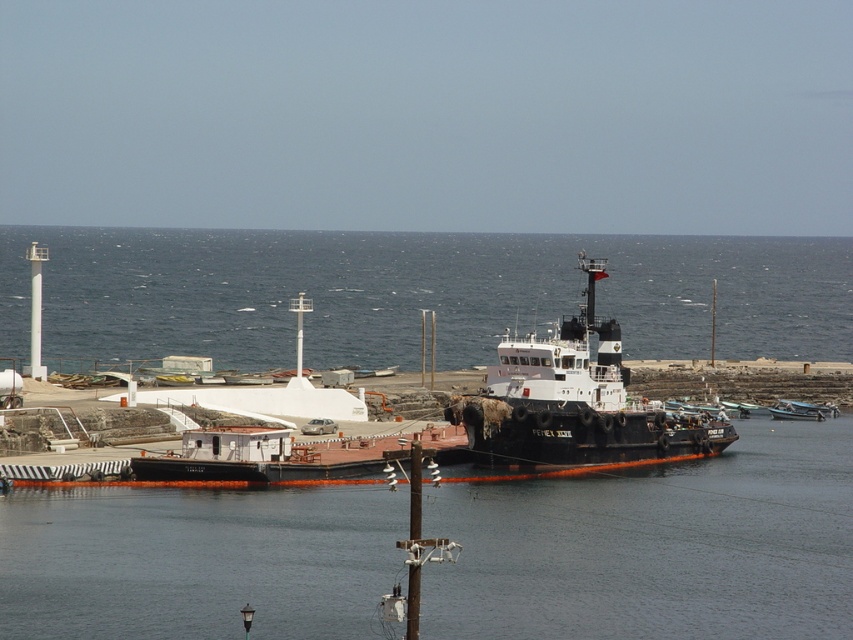
You are a harbor pilot who needs to guide a cargo ship through the channel. The cargo ship requires a minimum clearance of 400 feet between the blue water at center and the black rubber boat at center to safely pass. Based on the scene, is the current distance sufficient?

The blue water at center and black rubber boat at center are 411.43 feet apart. Since this distance exceeds the required 400 feet clearance, the cargo ship can safely pass through the channel.

You are a photographer planning to capture the entire scene of the blue water at center and the white matte boat at center in one shot. Based on their sizes, which object should you focus on to ensure both are fully visible in the frame?

The blue water at center has a larger width than the white matte boat at center, so focusing on the blue water at center would ensure both objects are fully visible in the frame.

You are standing at the point marked by the coordinates point (573, 403). Looking around, you see the black rubber boat at center. What object are you currently standing on?

You are standing on the black rubber boat at center represented by point (573, 403).